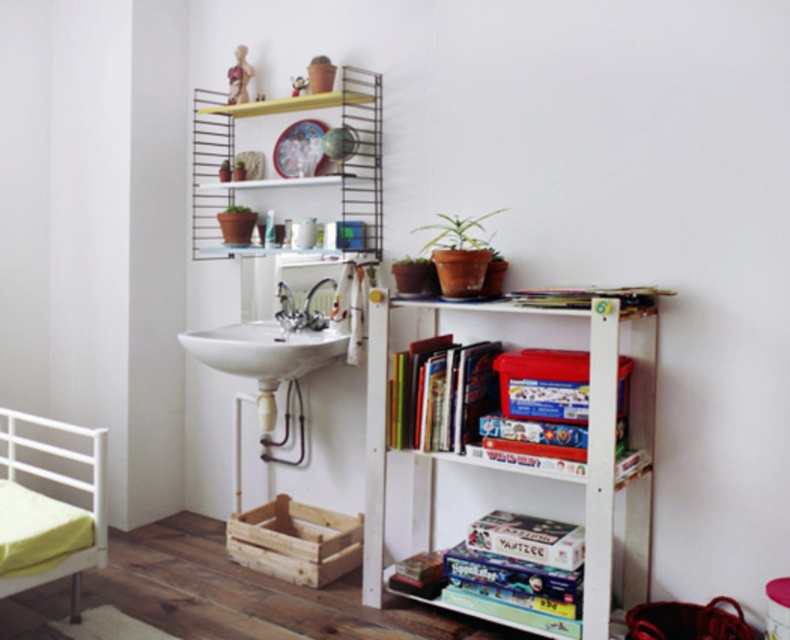
Question: Does wooden stool at lower right appear on the left side of silver metallic faucet at center?

Choices:
 (A) yes
 (B) no

Answer: (B)

Question: Which of these objects is positioned farthest from the white glossy sink at center?

Choices:
 (A) hardcover books at center
 (B) white metal bed at lower left

Answer: (B)

Question: Observing the image, what is the correct spatial positioning of hardcover book at upper center in reference to matte terracotta pot at upper center?

Choices:
 (A) left
 (B) right

Answer: (B)

Question: Which object appears farthest from the camera in this image?

Choices:
 (A) wooden mannequin at upper center
 (B) white glossy faucet at upper center
 (C) matte terracotta pot at upper center

Answer: (C)

Question: Is hardcover books at center smaller than matte plastic toy at upper center?

Choices:
 (A) yes
 (B) no

Answer: (B)

Question: Which object appears closest to the camera in this image?

Choices:
 (A) metallic wire shelf at upper center
 (B) hardcover books at center

Answer: (B)